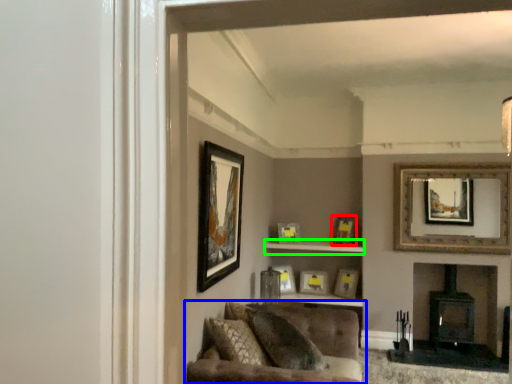
Question: Based on their relative distances, which object is farther from picture frame (highlighted by a red box)? Choose from studio couch (highlighted by a blue box) and cabinet (highlighted by a green box).

Choices:
 (A) studio couch
 (B) cabinet

Answer: (A)